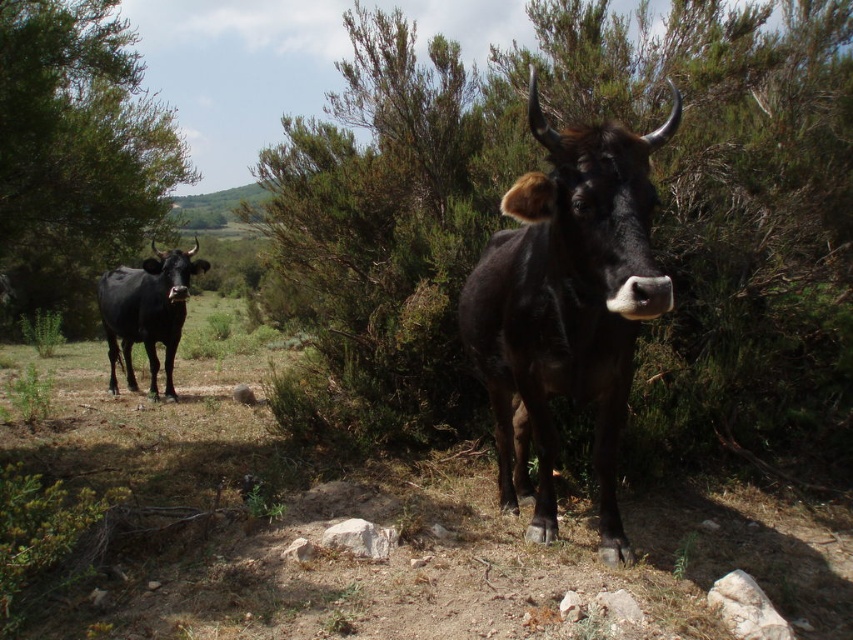
Question: Is green leafy bush at center further to camera compared to shiny black bull at left?

Choices:
 (A) yes
 (B) no

Answer: (B)

Question: Estimate the real-world distances between objects in this image. Which object is farther from the black glossy bull at center?

Choices:
 (A) shiny black bull at left
 (B) green leafy tree at left

Answer: (A)

Question: Does green leafy bush at center appear over black glossy bull at center?

Choices:
 (A) yes
 (B) no

Answer: (A)

Question: Is black glossy bull at center thinner than green leafy tree at left?

Choices:
 (A) no
 (B) yes

Answer: (B)

Question: Which of the following is the closest to the observer?

Choices:
 (A) (772, 328)
 (B) (674, 90)
 (C) (125, 310)

Answer: (B)

Question: Which of the following is the closest to the observer?

Choices:
 (A) black glossy bull at center
 (B) green leafy tree at left
 (C) green leafy bush at center

Answer: (A)